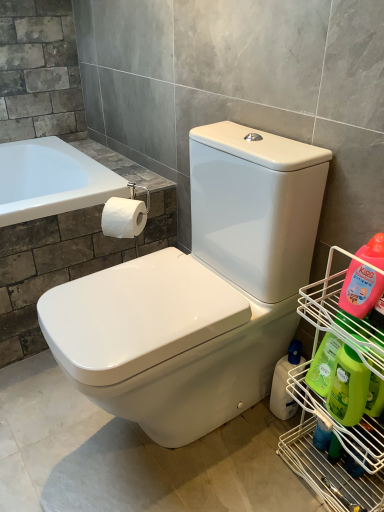
Question: Does green plastic bottle at right, arranged as the third cleaning product when viewed from the front, have a smaller size compared to green matte bottle at lower right, which is counted as the 2th cleaning product, starting from the front?

Choices:
 (A) yes
 (B) no

Answer: (A)

Question: From the image's perspective, is green plastic bottle at right, arranged as the 2th cleaning product when viewed from the back, under green matte bottle at lower right, the 3th cleaning product positioned from the back?

Choices:
 (A) no
 (B) yes

Answer: (A)

Question: From the image's perspective, is green plastic bottle at right, arranged as the 2th cleaning product when viewed from the back, on green matte bottle at lower right, the 3th cleaning product positioned from the back?

Choices:
 (A) yes
 (B) no

Answer: (A)

Question: Does green plastic bottle at right, arranged as the 2th cleaning product when viewed from the back, appear on the left side of green matte bottle at lower right, which is counted as the 2th cleaning product, starting from the front?

Choices:
 (A) no
 (B) yes

Answer: (B)

Question: Can you confirm if green plastic bottle at right, arranged as the 2th cleaning product when viewed from the back, is bigger than green matte bottle at lower right, which is counted as the 2th cleaning product, starting from the front?

Choices:
 (A) yes
 (B) no

Answer: (B)

Question: From the image's perspective, is green plastic bottle at right, arranged as the 2th cleaning product when viewed from the back, positioned above or below pink plastic bottle at right, acting as the 1th cleaning product starting from the front?

Choices:
 (A) above
 (B) below

Answer: (B)

Question: Relative to pink plastic bottle at right, acting as the 1th cleaning product starting from the front, is green plastic bottle at right, arranged as the 2th cleaning product when viewed from the back, in front or behind?

Choices:
 (A) front
 (B) behind

Answer: (B)

Question: In terms of width, does green plastic bottle at right, arranged as the third cleaning product when viewed from the front, look wider or thinner when compared to pink plastic bottle at right, acting as the 1th cleaning product starting from the front?

Choices:
 (A) thin
 (B) wide

Answer: (B)

Question: Considering the positions of green plastic bottle at right, arranged as the third cleaning product when viewed from the front, and pink plastic bottle at right, the fourth cleaning product positioned from the back, in the image, is green plastic bottle at right, arranged as the third cleaning product when viewed from the front, taller or shorter than pink plastic bottle at right, the fourth cleaning product positioned from the back,?

Choices:
 (A) short
 (B) tall

Answer: (B)

Question: Looking at the image, does green matte bottle at lower right, the 3th cleaning product positioned from the back, seem bigger or smaller compared to pink plastic bottle at right, the fourth cleaning product positioned from the back?

Choices:
 (A) small
 (B) big

Answer: (B)

Question: Considering the positions of point (334, 396) and point (357, 282), is point (334, 396) closer or farther from the camera than point (357, 282)?

Choices:
 (A) closer
 (B) farther

Answer: (B)

Question: Considering the positions of green matte bottle at lower right, which is counted as the 2th cleaning product, starting from the front, and pink plastic bottle at right, the fourth cleaning product positioned from the back, in the image, is green matte bottle at lower right, which is counted as the 2th cleaning product, starting from the front, taller or shorter than pink plastic bottle at right, the fourth cleaning product positioned from the back,?

Choices:
 (A) short
 (B) tall

Answer: (B)

Question: Based on their positions, is green matte bottle at lower right, the 3th cleaning product positioned from the back, located to the left or right of pink plastic bottle at right, acting as the 1th cleaning product starting from the front?

Choices:
 (A) left
 (B) right

Answer: (A)

Question: From the image's perspective, is metal wire rack at right located above or below white matte toilet paper at upper left?

Choices:
 (A) below
 (B) above

Answer: (A)

Question: In terms of width, does metal wire rack at right look wider or thinner when compared to white matte toilet paper at upper left?

Choices:
 (A) wide
 (B) thin

Answer: (A)